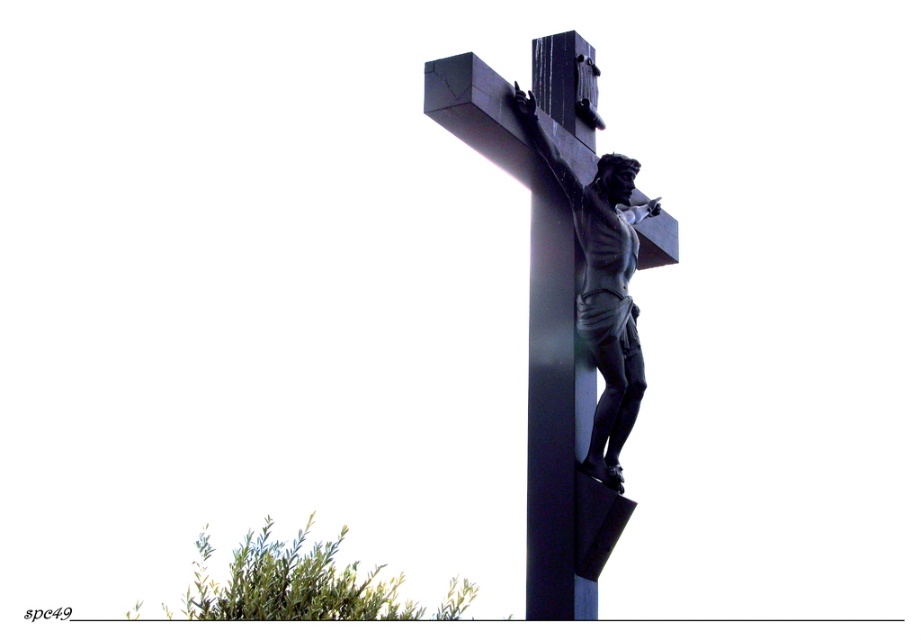
You are an artist trying to paint the crucifix scene. You need to place a small golden star decoration exactly at the point marked by coordinates point [556,422]. Where on the crucifix should you place the star?

The point [556,422] marks the glossy dark wood pole at center, so you should place the star on the glossy dark wood pole at center of the crucifix.

You are an art student analyzing the composition of the crucifix in the image. Which object, the black polished cross at center or the glossy dark wood pole at center, is positioned lower in the scene?

The black polished cross at center is positioned lower than the glossy dark wood pole at center in the scene.

You are an art curator planning to display both the black polished cross at center and the polished bronze crucifix at center in a gallery. Given their sizes, which one would require more space for proper display?

The black polished cross at center is bigger than the polished bronze crucifix at center, so it would require more space for proper display.